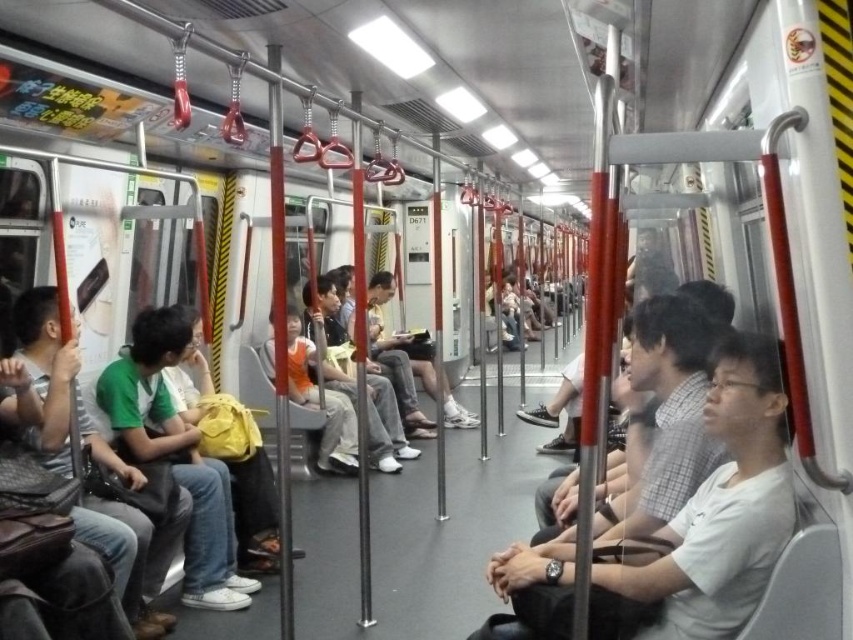
You are a passenger on the subway and see a green fabric backpack at left and a yellow fabric backpack at center. Which backpack is positioned to the right of the other?

The green fabric backpack at left is positioned to the right of the yellow fabric backpack at center.

You are a photographer trying to capture a candid shot of the white matte shirt at right and the yellow fabric backpack at center in the subway train. Since you want to ensure both subjects are in focus, you need to know their relative sizes. Which object is taller?

The white matte shirt at right has a greater height compared to the yellow fabric backpack at center, so the white matte shirt at right is taller.

You are a passenger on the subway train and you notice a white matte shirt at right and a green fabric backpack at left. Which object is located higher up in the scene?

The white matte shirt at right is positioned over the green fabric backpack at left, so it is higher up in the scene.